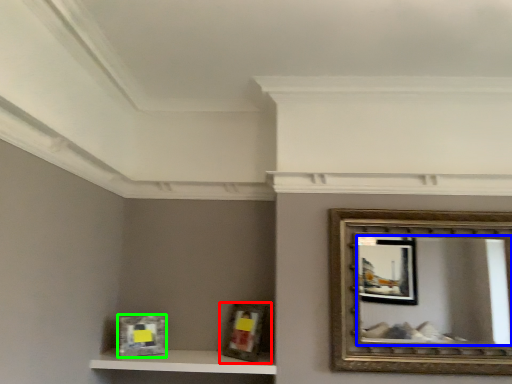
Question: Which object is the closest to the picture frame (highlighted by a red box)? Choose among these: mirror (highlighted by a blue box) or picture frame (highlighted by a green box).

Choices:
 (A) mirror
 (B) picture frame

Answer: (B)